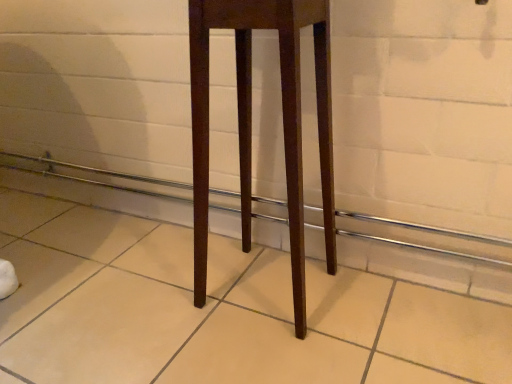
I want to click on free space that is in between mahogany wood stool at center and brown wooden balustrade at center, so click(x=189, y=266).